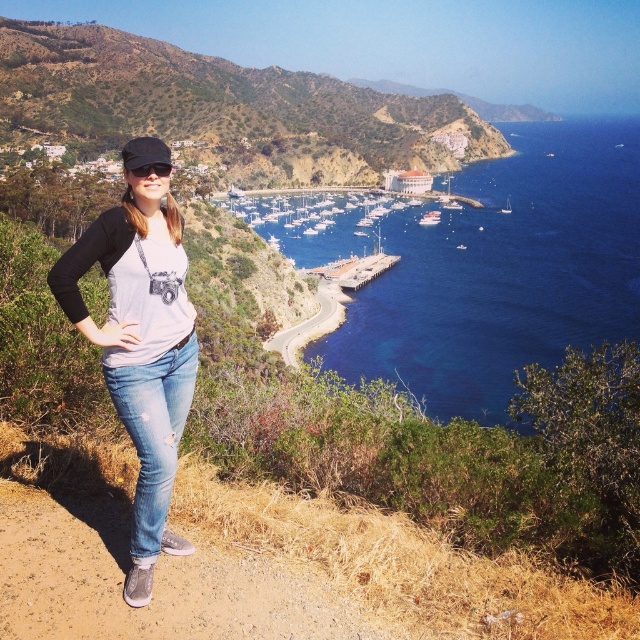
In the scene shown: Between light blue denim jeans at lower left and smooth asphalt road at center, which one is positioned higher?

Positioned higher is smooth asphalt road at center.

Does light blue denim jeans at lower left have a lesser width compared to smooth asphalt road at center?

Yes.

The image size is (640, 640). In order to click on light blue denim jeans at lower left in this screenshot , I will do `click(154, 436)`.

Is denim jeans at center bigger than smooth asphalt road at center?

Actually, denim jeans at center might be smaller than smooth asphalt road at center.

Does denim jeans at center have a greater height compared to smooth asphalt road at center?

Yes.

Where is `denim jeans at center`? denim jeans at center is located at coordinates (140, 349).

In order to click on denim jeans at center in this screenshot , I will do `click(140, 349)`.

Which is above, black fabric baseball cap at upper left or black matte goggles at upper center?

black fabric baseball cap at upper left is higher up.

Does black fabric baseball cap at upper left appear over black matte goggles at upper center?

Yes, black fabric baseball cap at upper left is above black matte goggles at upper center.

Where is `black fabric baseball cap at upper left`? black fabric baseball cap at upper left is located at coordinates (145, 152).